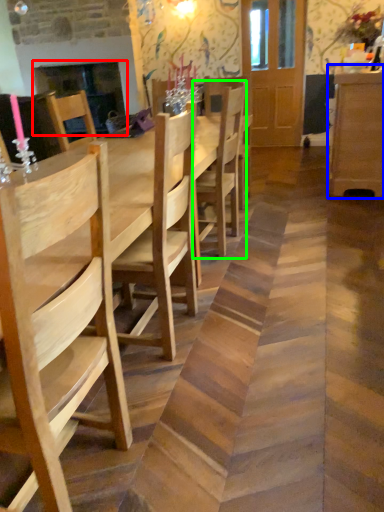
Question: Based on their relative distances, which object is nearer to fireplace (highlighted by a red box)? Choose from dresser (highlighted by a blue box) and chair (highlighted by a green box).

Choices:
 (A) dresser
 (B) chair

Answer: (B)